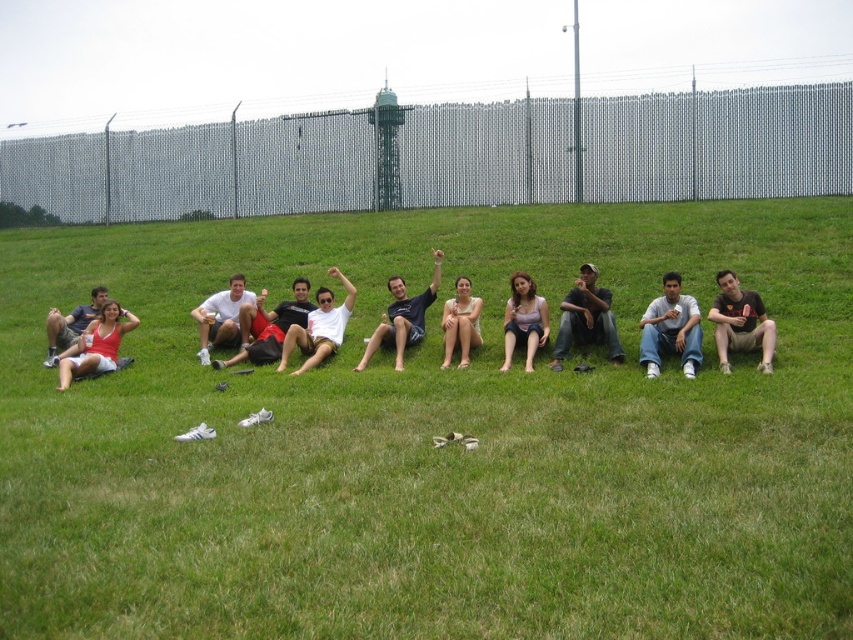
Question: Can you confirm if light brown shorts at center is thinner than matte white dress at center?

Choices:
 (A) no
 (B) yes

Answer: (A)

Question: Which of these objects is positioned farthest from the metallic silver fence at upper center?

Choices:
 (A) matte red tank top at left
 (B) dark blue t-shirt at center

Answer: (A)

Question: Which of the following is the closest to the observer?

Choices:
 (A) (599, 291)
 (B) (397, 275)
 (C) (740, 332)

Answer: (C)

Question: Does metallic silver fence at upper center have a greater width compared to dark blue jeans at center?

Choices:
 (A) yes
 (B) no

Answer: (A)

Question: Does metallic silver fence at upper center have a greater width compared to brown cotton shirt at right?

Choices:
 (A) yes
 (B) no

Answer: (A)

Question: Estimate the real-world distances between objects in this image. Which object is closer to the dark blue t-shirt at center?

Choices:
 (A) matte white shirt at left
 (B) light blue jeans at center
 (C) matte white dress at center

Answer: (C)